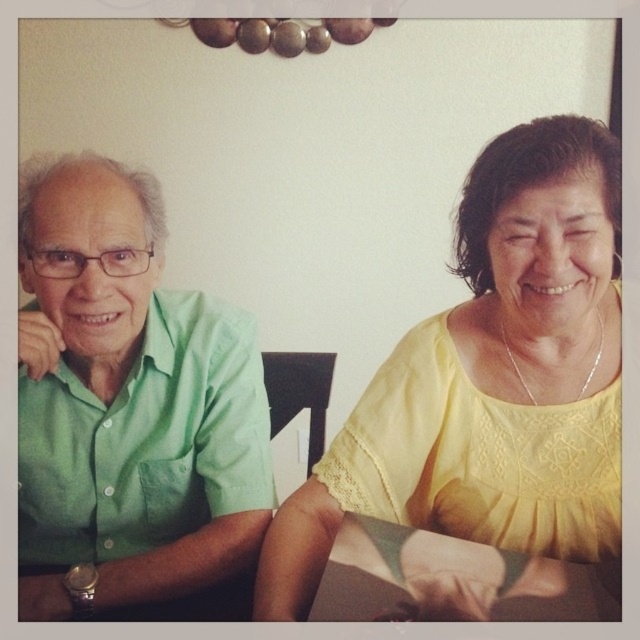
Between yellow lace blouse at upper right and wooden table at lower center, which one is positioned lower?

wooden table at lower center is lower down.

Does yellow lace blouse at upper right have a smaller size compared to wooden table at lower center?

Actually, yellow lace blouse at upper right might be larger than wooden table at lower center.

Measure the distance between yellow lace blouse at upper right and camera.

The distance of yellow lace blouse at upper right from camera is 27.56 inches.

Find the location of `yellow lace blouse at upper right`. yellow lace blouse at upper right is located at coordinates 490,380.

Is point (460, 388) closer to viewer compared to point (52, 593)?

No, (460, 388) is further to viewer.

Is yellow lace blouse at upper right shorter than green matte shirt at left?

Yes.

At what (x,y) coordinates should I click in order to perform the action: click on yellow lace blouse at upper right. Please return your answer as a coordinate pair (x, y). Image resolution: width=640 pixels, height=640 pixels. Looking at the image, I should click on (490, 380).

Locate an element on the screen. yellow lace blouse at upper right is located at coordinates (490, 380).

Which of these two, green matte shirt at left or wooden table at lower center, stands shorter?

Standing shorter between the two is wooden table at lower center.

Which is behind, point (32, 275) or point (544, 570)?

Positioned behind is point (32, 275).

The height and width of the screenshot is (640, 640). Identify the location of green matte shirt at left. (128, 403).